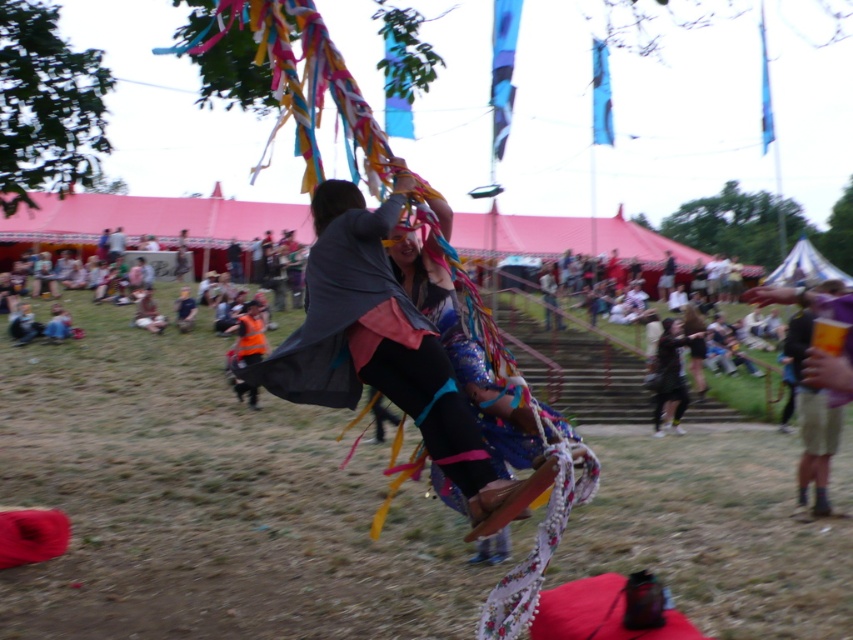
Can you confirm if black fabric pants at center is wider than orange reflective vest at center?

Indeed, black fabric pants at center has a greater width compared to orange reflective vest at center.

Does point (682, 333) come in front of point (242, 316)?

No.

Where is `black fabric pants at center`? black fabric pants at center is located at coordinates (669, 372).

Does shiny metallic cape at center appear on the right side of orange reflective vest at center?

Indeed, shiny metallic cape at center is positioned on the right side of orange reflective vest at center.

Can you confirm if shiny metallic cape at center is bigger than orange reflective vest at center?

Yes.

Identify the location of shiny metallic cape at center. The width and height of the screenshot is (853, 640). (383, 348).

Can you confirm if shiny metallic cape at center is positioned below black fabric pants at center?

No.

Which is above, shiny metallic cape at center or black fabric pants at center?

shiny metallic cape at center is above.

Is point (375, 333) farther from camera compared to point (659, 342)?

No, it is in front of (659, 342).

Identify the location of shiny metallic cape at center. Image resolution: width=853 pixels, height=640 pixels. (383, 348).